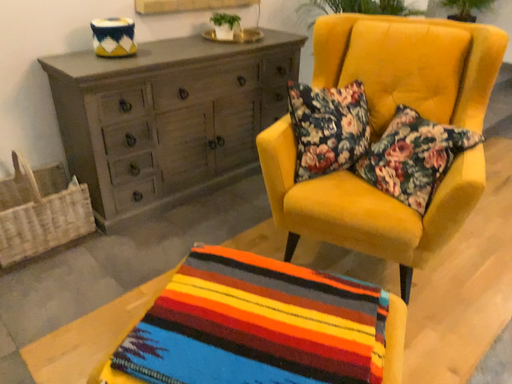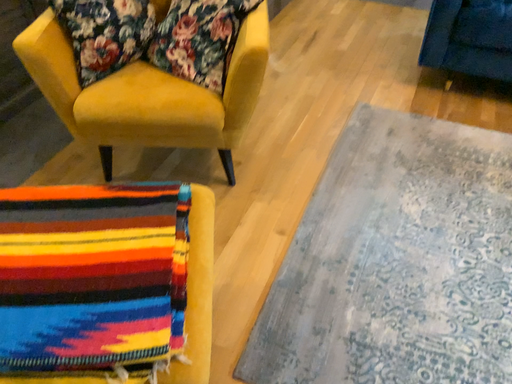
Question: Which way did the camera rotate in the video?

Choices:
 (A) rotated downward
 (B) rotated upward

Answer: (A)